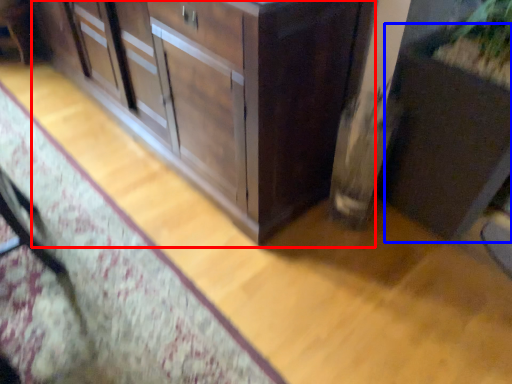
Question: Which object is further to the camera taking this photo, cabinetry (highlighted by a red box) or cabinetry (highlighted by a blue box)?

Choices:
 (A) cabinetry
 (B) cabinetry

Answer: (A)